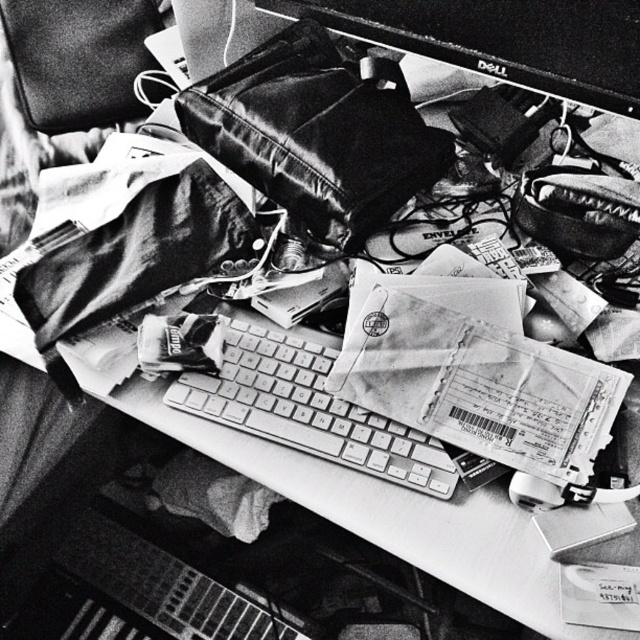
Does leather bag at center lie in front of metallic keyboard at center?

No, it is behind metallic keyboard at center.

Consider the image. Is leather bag at center to the left of metallic keyboard at center from the viewer's perspective?

Indeed, leather bag at center is positioned on the left side of metallic keyboard at center.

Who is more forward, (248, 106) or (276, 376)?

Point (276, 376)

I want to click on leather bag at center, so click(x=317, y=132).